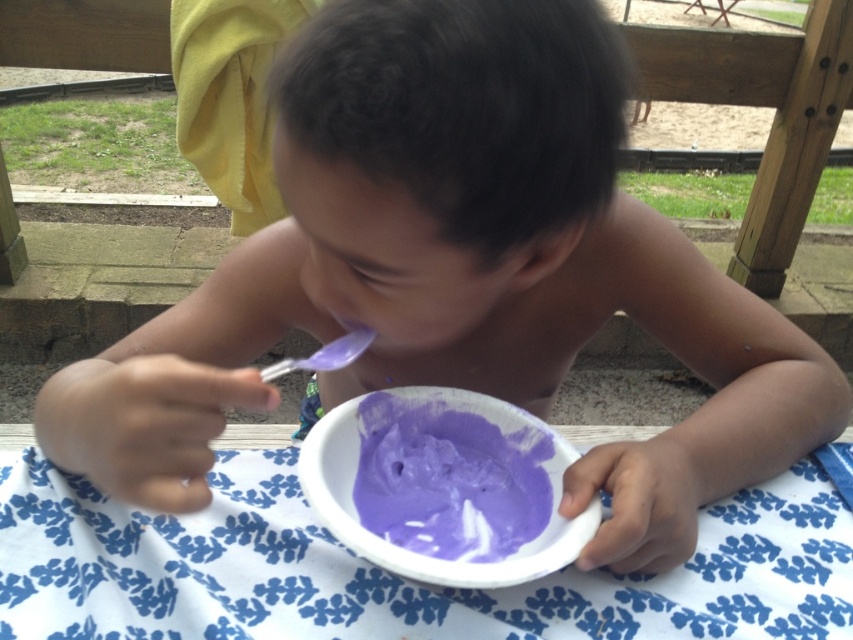
From the picture: You are a chef preparing to place a decorative napkin on the table. You have a white fabric at center and a transparent plastic spoon at center in front of you. Which item has a greater width?

The white fabric at center has a greater width than the transparent plastic spoon at center according to the description.